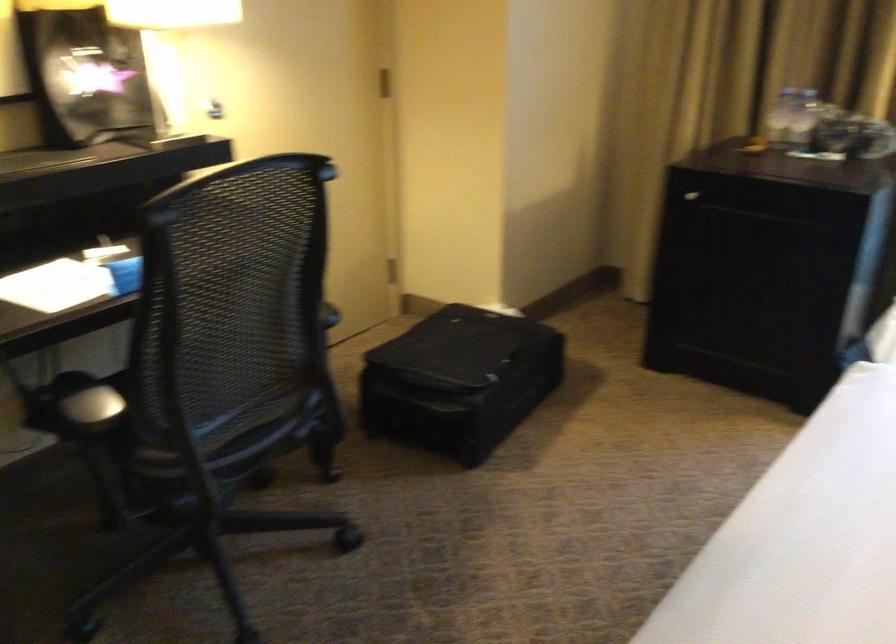
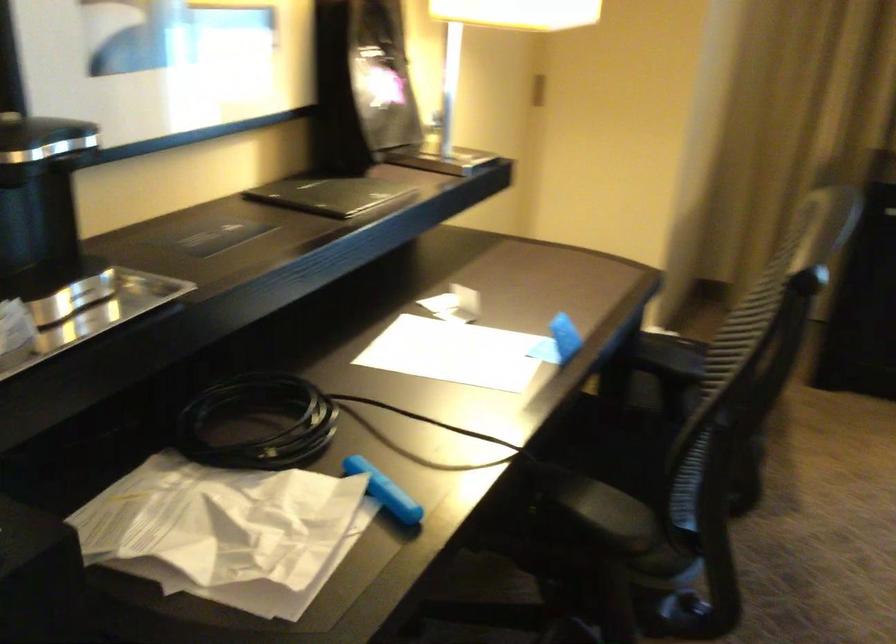
In the second image, find the point that corresponds to point (250, 386) in the first image.

(625, 457)